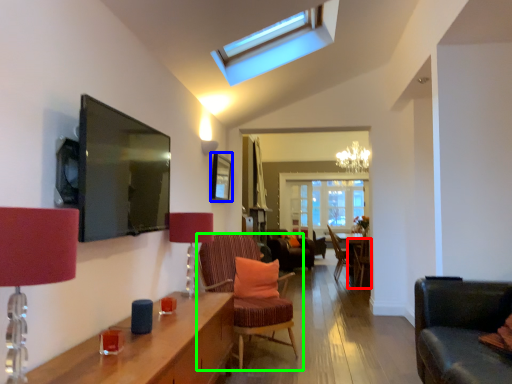
Question: Which object is positioned closest to chair (highlighted by a red box)? Select from picture frame (highlighted by a blue box) and chair (highlighted by a green box).

Choices:
 (A) picture frame
 (B) chair

Answer: (A)